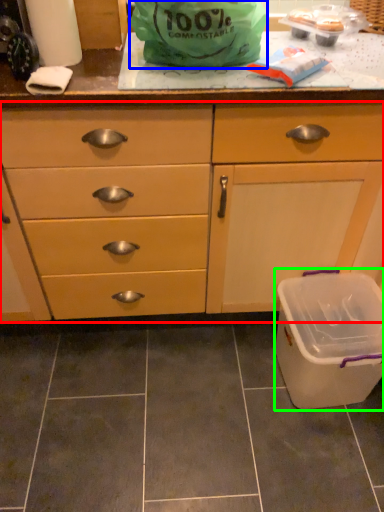
Question: Based on their relative distances, which object is farther from cabinetry (highlighted by a red box)? Choose from plastic bag (highlighted by a blue box) and recycling bin (highlighted by a green box).

Choices:
 (A) plastic bag
 (B) recycling bin

Answer: (A)